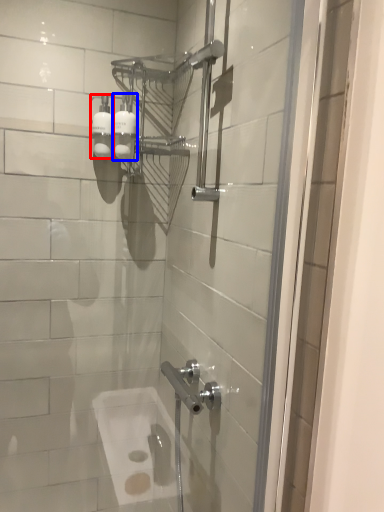
Question: Which of the following is the closest to the observer, toiletry (highlighted by a red box) or toiletry (highlighted by a blue box)?

Choices:
 (A) toiletry
 (B) toiletry

Answer: (B)